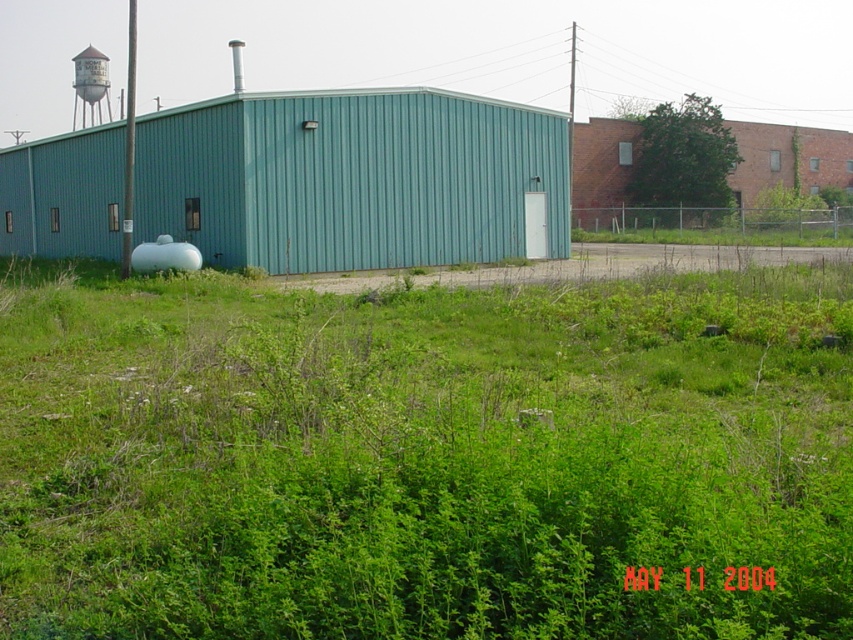
Question: Which object is the farthest from the white matte water tank at center-left?

Choices:
 (A) white painted metal water tower at upper left
 (B) teal corrugated metal shed at center
 (C) green leafy grass at center

Answer: (A)

Question: Which of the following is the farthest from the observer?

Choices:
 (A) green leafy grass at center
 (B) white painted metal water tower at upper left
 (C) teal corrugated metal shed at center
 (D) white matte water tank at center-left

Answer: (B)

Question: Is white painted metal water tower at upper left wider than white matte water tank at center-left?

Choices:
 (A) no
 (B) yes

Answer: (B)

Question: Does green leafy grass at center lie in front of white painted metal water tower at upper left?

Choices:
 (A) yes
 (B) no

Answer: (A)

Question: Does green leafy grass at center come in front of teal corrugated metal shed at center?

Choices:
 (A) yes
 (B) no

Answer: (A)

Question: Which object is the closest to the teal corrugated metal shed at center?

Choices:
 (A) white matte water tank at center-left
 (B) green leafy grass at center

Answer: (A)